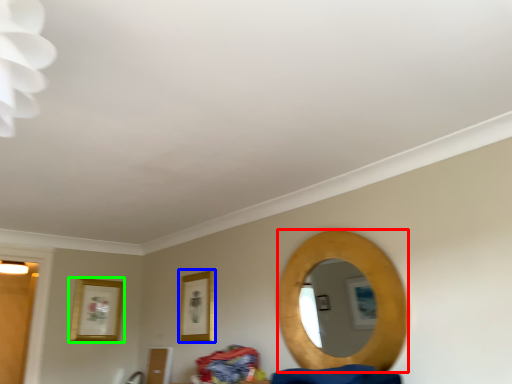
Question: Which object is positioned closest to mirror (highlighted by a red box)? Select from picture frame (highlighted by a blue box) and picture frame (highlighted by a green box).

Choices:
 (A) picture frame
 (B) picture frame

Answer: (A)